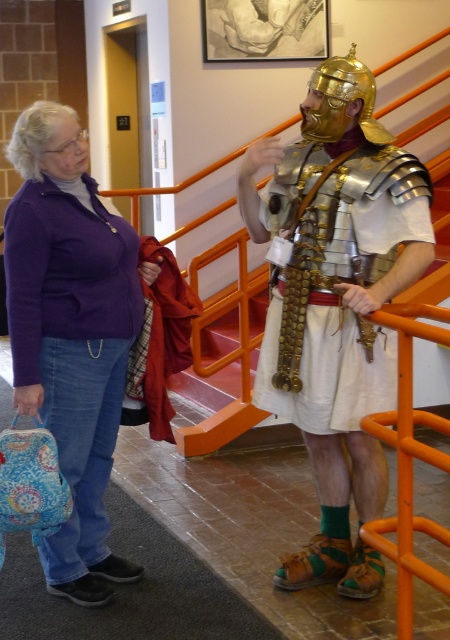
Question: Is shiny gold armor at center bigger than purple sweater at left?

Choices:
 (A) yes
 (B) no

Answer: (A)

Question: Which point is closer to the camera?

Choices:
 (A) (98, 292)
 (B) (319, 497)

Answer: (A)

Question: Which point is closer to the camera taking this photo?

Choices:
 (A) (342, 401)
 (B) (103, 244)

Answer: (B)

Question: Is shiny gold armor at center bigger than purple sweater at left?

Choices:
 (A) yes
 (B) no

Answer: (A)

Question: Is shiny gold armor at center closer to the viewer compared to purple sweater at left?

Choices:
 (A) yes
 (B) no

Answer: (A)